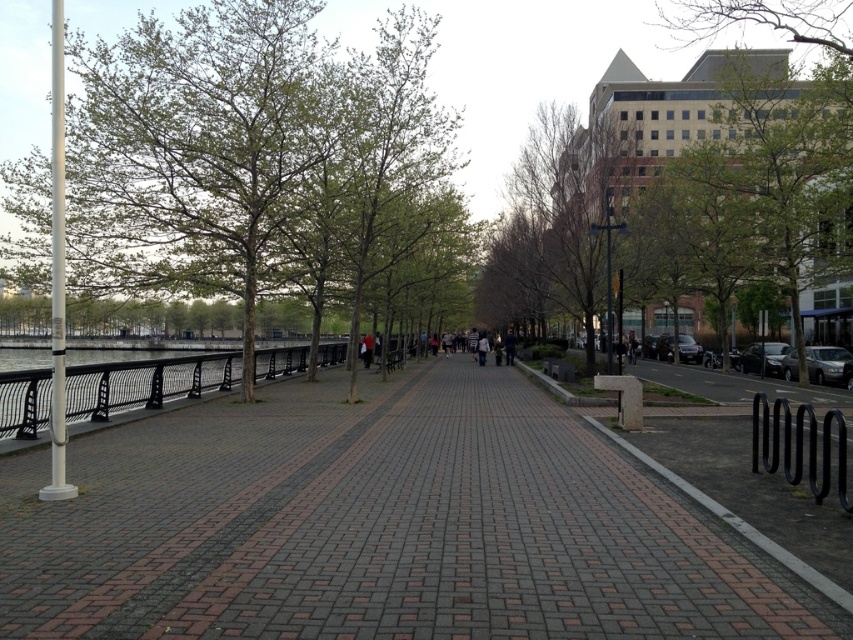
Question: Is green leafy tree at left in front of clear glass water at left?

Choices:
 (A) no
 (B) yes

Answer: (A)

Question: Which object is the closest to the green leafy tree at left?

Choices:
 (A) light brown leather jacket at center
 (B) metallic silver sedan at right
 (C) brick paved walkway at center
 (D) clear glass water at left

Answer: (D)

Question: Which object appears closest to the camera in this image?

Choices:
 (A) shiny black car at right
 (B) clear glass water at left
 (C) green leafy tree at left

Answer: (B)

Question: Can you confirm if brick paved walkway at center is bigger than metallic silver sedan at right?

Choices:
 (A) no
 (B) yes

Answer: (A)

Question: Does shiny black car at right appear on the right side of dark brown leather jacket at center?

Choices:
 (A) yes
 (B) no

Answer: (A)

Question: Which object is farther from the camera taking this photo?

Choices:
 (A) metallic silver sedan at right
 (B) shiny black car at right
 (C) dark brown leather jacket at center

Answer: (C)